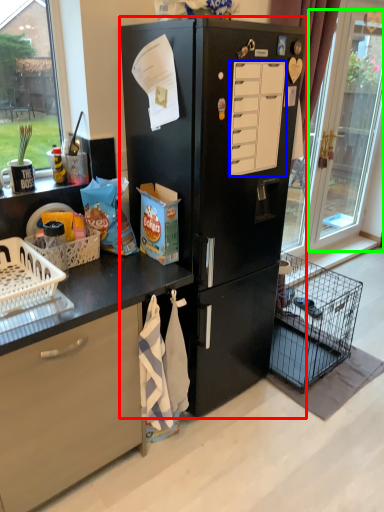
Question: Which object is the closest to the refrigerator (highlighted by a red box)? Choose among these: drawer (highlighted by a blue box) or glass door (highlighted by a green box).

Choices:
 (A) drawer
 (B) glass door

Answer: (A)